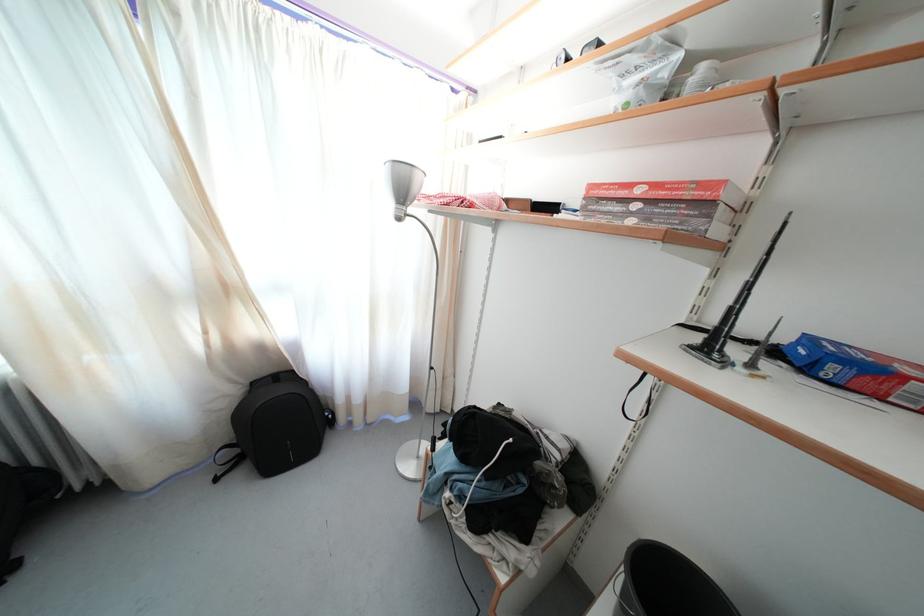
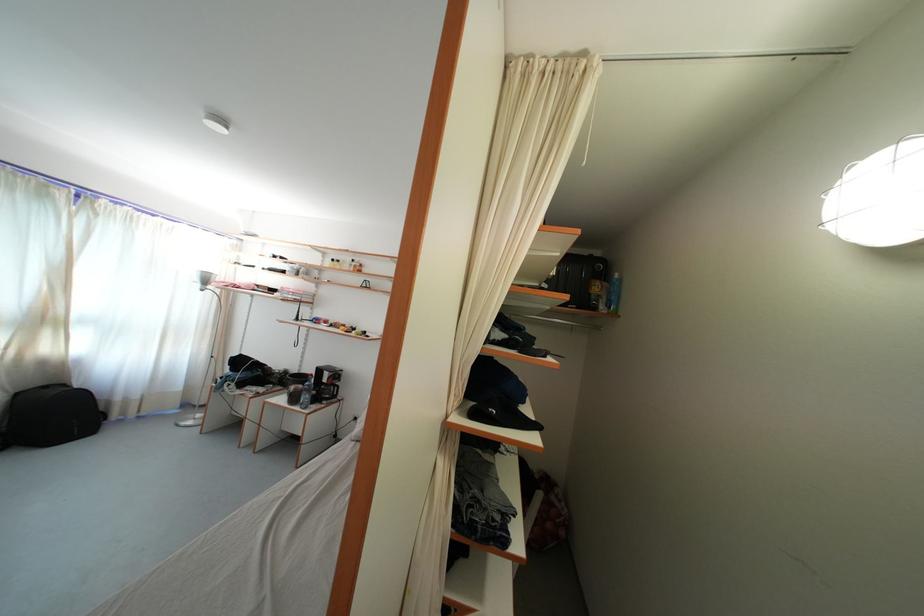
Where in the second image is the point corresponding to point 363,406 from the first image?

(141, 403)